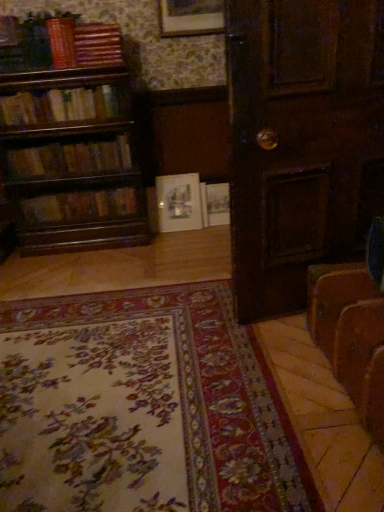
Question: Is wooden bookshelf at left, acting as the 3th book starting from the top, in front of or behind wooden picture frame at upper center, arranged as the second picture frame when ordered from the bottom, in the image?

Choices:
 (A) behind
 (B) front

Answer: (B)

Question: Based on their positions, is wooden bookshelf at left, acting as the 3th book starting from the top, located to the left or right of wooden picture frame at upper center, marked as the 1th picture frame in a front-to-back arrangement?

Choices:
 (A) left
 (B) right

Answer: (A)

Question: Which is farther from the white paper book at center, placed as the 2th book when sorted from bottom to top?

Choices:
 (A) wooden book at upper left, which is counted as the sixth book, starting from the bottom
 (B) floral carpet at lower center
 (C) wooden bookshelf at left, the fourth book ordered from the bottom
 (D) brown leather suitcase at lower right
 (E) dark wood door at center

Answer: (D)

Question: Which object is the farthest from the wooden bookshelf at left, acting as the 3th book starting from the top?

Choices:
 (A) white matte picture frame at center, positioned as the first picture frame in bottom-to-top order
 (B) wooden picture frame at upper center, the 2th picture frame in the back-to-front sequence
 (C) wooden book at upper left, positioned as the fifth book in bottom-to-top order
 (D) wooden bookshelf at left, the fourth book when ordered from top to bottom
 (E) white paper book at center, the 5th book when ordered from top to bottom

Answer: (E)